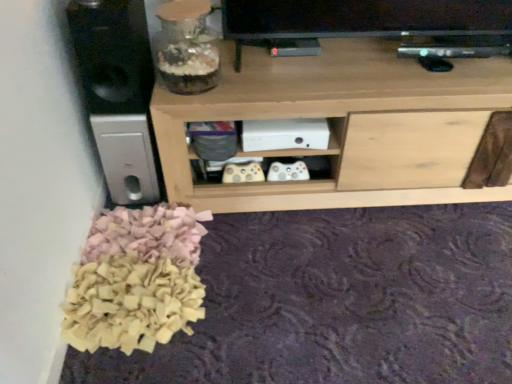
Image resolution: width=512 pixels, height=384 pixels. Identify the location of free point above natural wood shelf at center (from a real-world perspective). (359, 58).